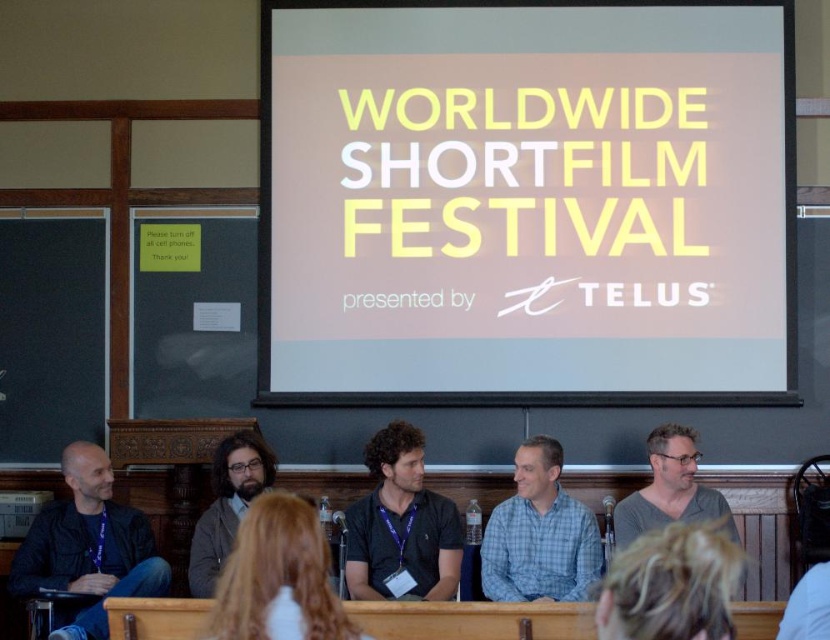
Find the location of a particular element. The width and height of the screenshot is (830, 640). black leather jacket at left is located at coordinates (86, 548).

Which is in front, point (116, 536) or point (554, 474)?

Point (554, 474)

You are a GUI agent. You are given a task and a screenshot of the screen. Output one action in this format:
    pyautogui.click(x=<x>, y=<y>)
    Task: Click on the black leather jacket at left
    The width and height of the screenshot is (830, 640).
    Given the screenshot: What is the action you would take?
    pyautogui.click(x=86, y=548)

Which is below, black leather jacket at left or dark brown hair at center?

black leather jacket at left

Between point (159, 593) and point (247, 564), which one is positioned behind?

Positioned behind is point (159, 593).

The width and height of the screenshot is (830, 640). Find the location of `black leather jacket at left`. black leather jacket at left is located at coordinates [x=86, y=548].

Locate an element on the screen. The width and height of the screenshot is (830, 640). black leather jacket at left is located at coordinates (86, 548).

Is black leather jacket at left to the left of bearded man with glasses at center from the viewer's perspective?

Indeed, black leather jacket at left is positioned on the left side of bearded man with glasses at center.

Does black leather jacket at left lie behind bearded man with glasses at center?

No, black leather jacket at left is closer to the viewer.

Identify the location of black leather jacket at left. (86, 548).